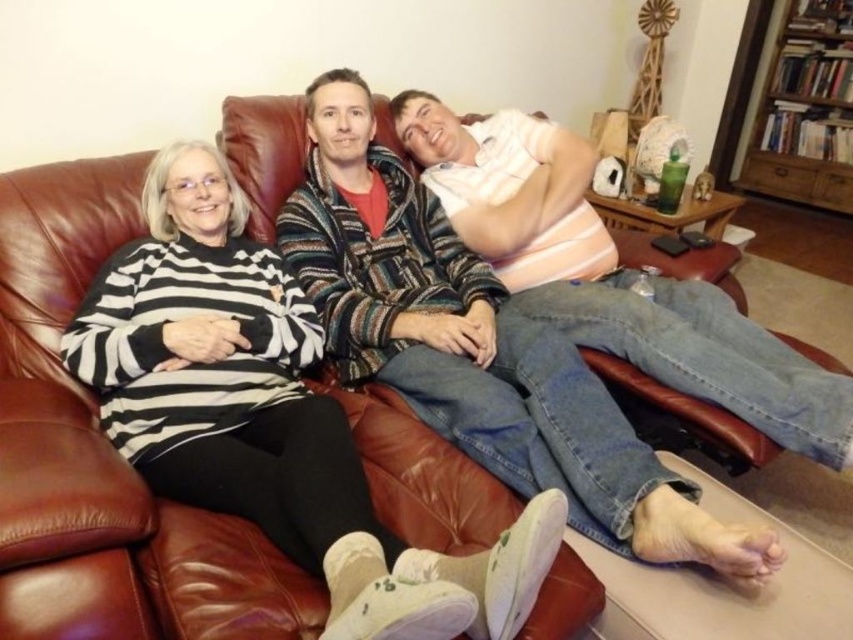
Question: Does black and white striped sweater at left have a larger size compared to striped sweater at center?

Choices:
 (A) no
 (B) yes

Answer: (A)

Question: Is black and white striped sweater at left above striped sweater at center?

Choices:
 (A) no
 (B) yes

Answer: (A)

Question: Which point is farther to the camera?

Choices:
 (A) black and white striped sweater at left
 (B) striped sweater at center

Answer: (B)

Question: Which of the following is the farthest from the observer?

Choices:
 (A) click(341, 582)
 (B) click(386, 189)

Answer: (B)

Question: Is black and white striped sweater at left below striped sweater at center?

Choices:
 (A) yes
 (B) no

Answer: (A)

Question: Which object appears closest to the camera in this image?

Choices:
 (A) black and white striped sweater at left
 (B) striped sweater at center

Answer: (A)